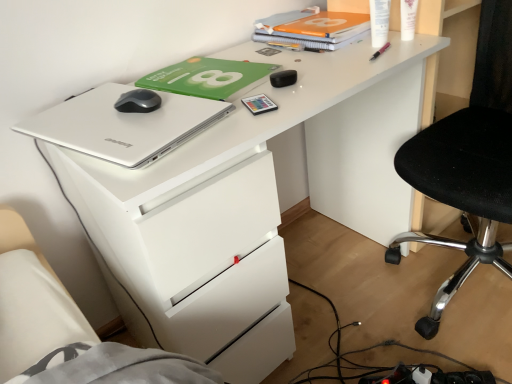
Locate an element on the screen. The width and height of the screenshot is (512, 384). vacant space to the right of matte plastic card at center, acting as the fifth stationery starting from the top is located at coordinates (318, 88).